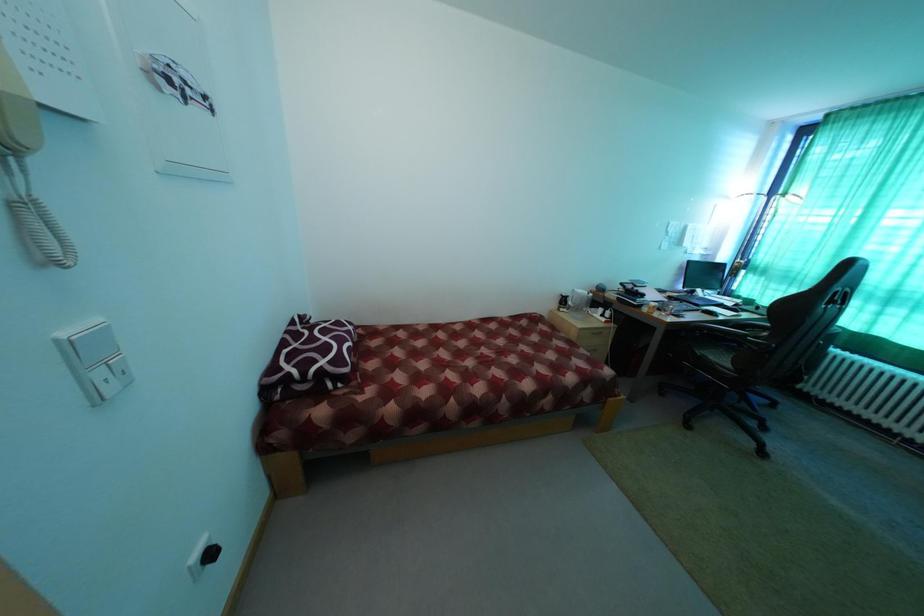
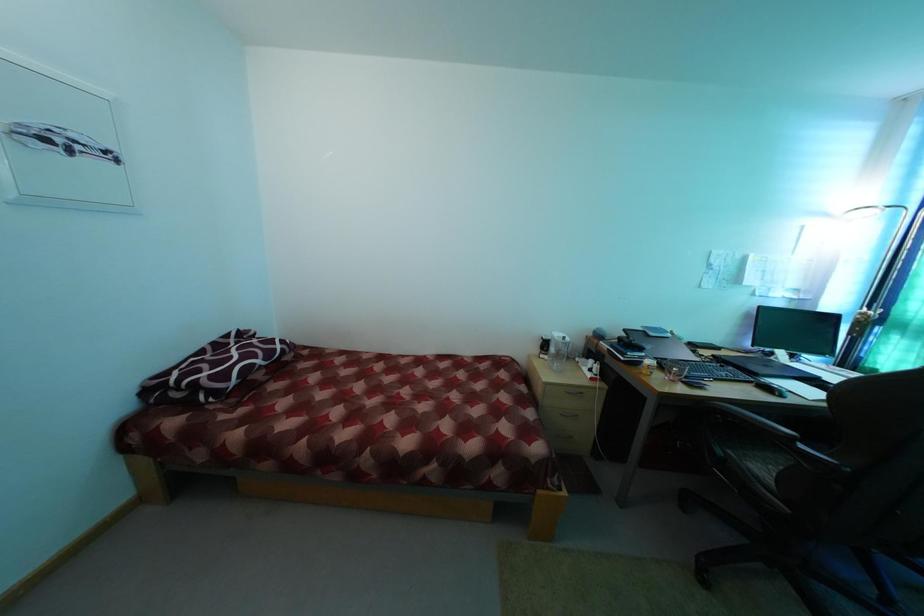
What movement of the cameraman would produce the second image?

The movement direction of the cameraman is right, forward.